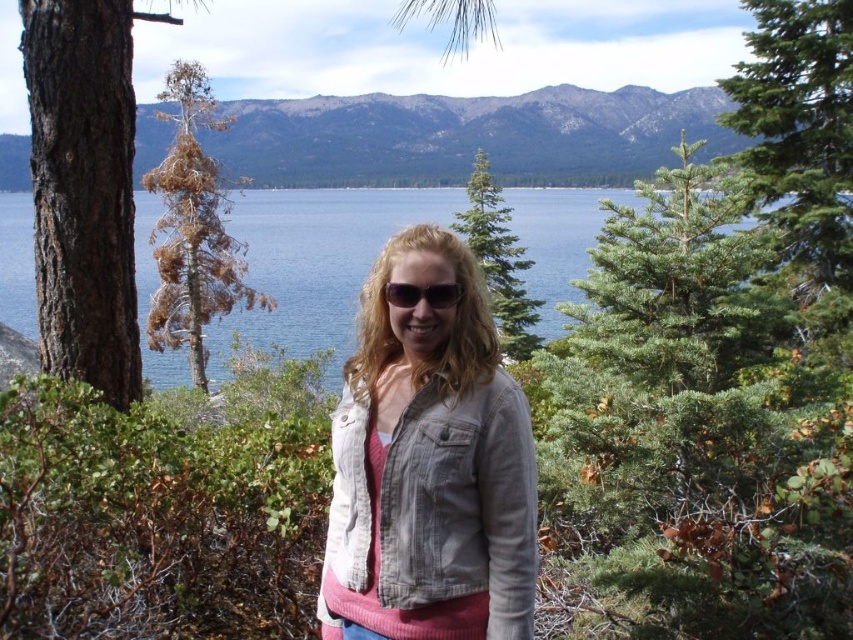
Between blue water at center and dark brown rough bark at left, which one appears on the right side from the viewer's perspective?

Positioned to the right is blue water at center.

Which is behind, point (421, 196) or point (28, 4)?

Point (421, 196)

Who is more forward, (339, 205) or (111, 70)?

Point (111, 70)

Identify the location of blue water at center. This screenshot has height=640, width=853. (317, 259).

Which is in front, point (366, 458) or point (517, 305)?

Positioned in front is point (366, 458).

Which is more to the right, denim jacket at center or green textured pine tree at center?

green textured pine tree at center

Is point (447, 481) farther from camera compared to point (474, 195)?

No, (447, 481) is closer to viewer.

Locate an element on the screen. This screenshot has height=640, width=853. denim jacket at center is located at coordinates (428, 465).

Between point (207, 230) and point (392, 300), which one is positioned behind?

Positioned behind is point (207, 230).

How distant is brown/dried wood tree at left from sunglasses at center?

brown/dried wood tree at left and sunglasses at center are 32.36 meters apart.

I want to click on brown/dried wood tree at left, so click(192, 228).